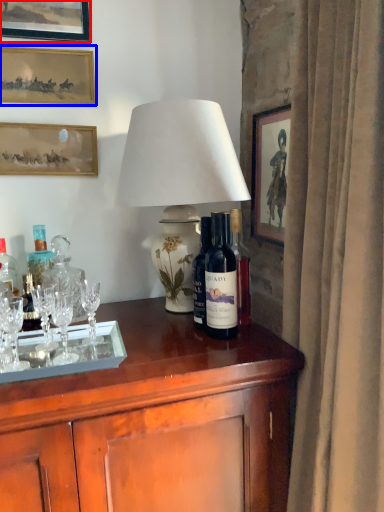
Question: Which point is closer to the camera, picture frame (highlighted by a red box) or picture frame (highlighted by a blue box)?

Choices:
 (A) picture frame
 (B) picture frame

Answer: (A)